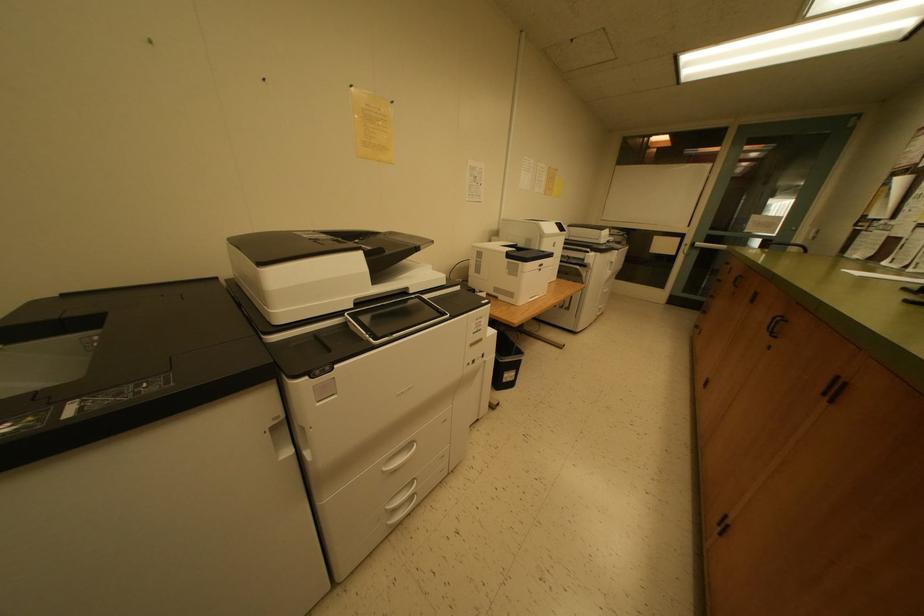
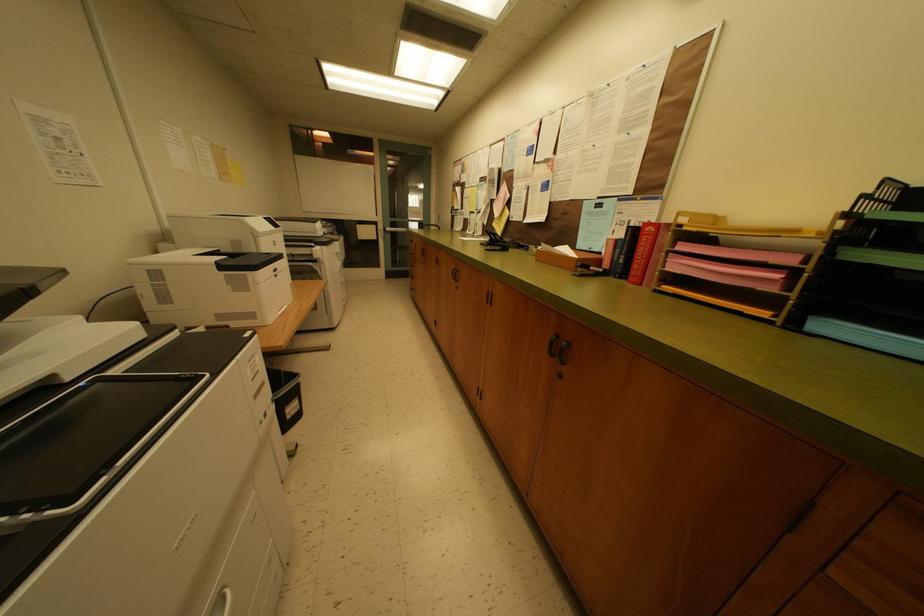
Question: The camera is either moving clockwise (left) or counter-clockwise (right) around the object. The first image is from the beginning of the video and the second image is from the end. Is the camera moving left or right when shooting the video?

Choices:
 (A) Left
 (B) Right

Answer: (A)